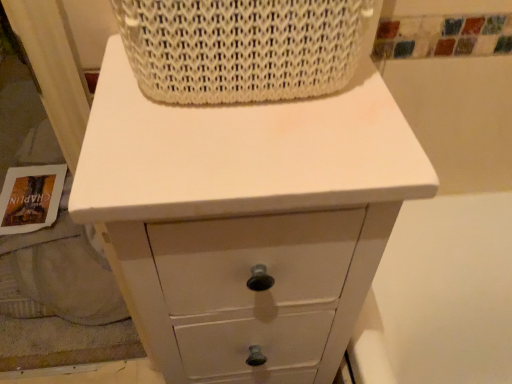
Question: From the image's perspective, is white woven basket at upper center located above or below white matte chest of drawers at center?

Choices:
 (A) above
 (B) below

Answer: (A)

Question: Considering the positions of white woven basket at upper center and white matte chest of drawers at center in the image, is white woven basket at upper center bigger or smaller than white matte chest of drawers at center?

Choices:
 (A) small
 (B) big

Answer: (A)

Question: Visually, is white woven basket at upper center positioned to the left or to the right of white matte chest of drawers at center?

Choices:
 (A) left
 (B) right

Answer: (B)

Question: Based on their sizes in the image, would you say white matte chest of drawers at center is bigger or smaller than white woven basket at upper center?

Choices:
 (A) small
 (B) big

Answer: (B)

Question: Based on their positions, is white matte chest of drawers at center located to the left or right of white woven basket at upper center?

Choices:
 (A) left
 (B) right

Answer: (A)

Question: From their relative heights in the image, would you say white matte chest of drawers at center is taller or shorter than white woven basket at upper center?

Choices:
 (A) short
 (B) tall

Answer: (B)

Question: Considering the positions of white matte chest of drawers at center and white woven basket at upper center in the image, is white matte chest of drawers at center wider or thinner than white woven basket at upper center?

Choices:
 (A) wide
 (B) thin

Answer: (A)